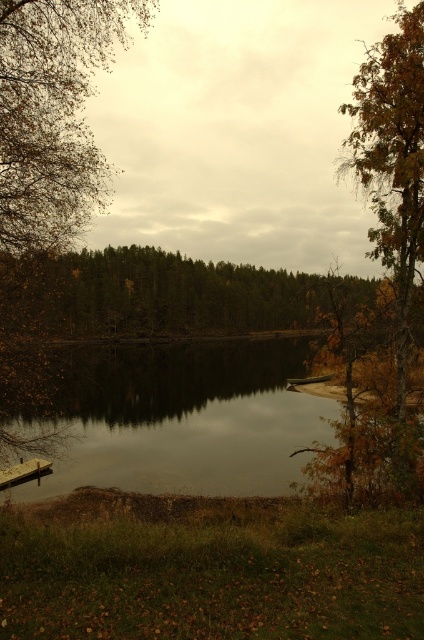
In the scene shown: You are an environmental scientist studying tree growth patterns in this lakeside area. You observe the brown leafy tree at right and the brown leafy tree at left. Which tree has a narrower trunk?

The brown leafy tree at right is thinner than the brown leafy tree at left, so the tree at the right has a narrower trunk.

You are standing at the center of the image and want to walk towards the brown leafy tree at right. In which direction should you go?

You should go to the right direction because the brown leafy tree at right is located at the right side of the image.